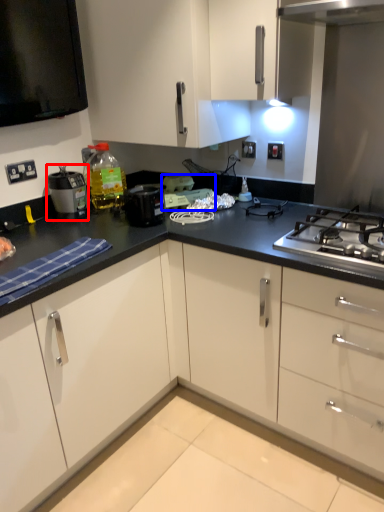
Question: Which of the following is the farthest to the observer, kitchen appliance (highlighted by a red box) or appliance (highlighted by a blue box)?

Choices:
 (A) kitchen appliance
 (B) appliance

Answer: (B)